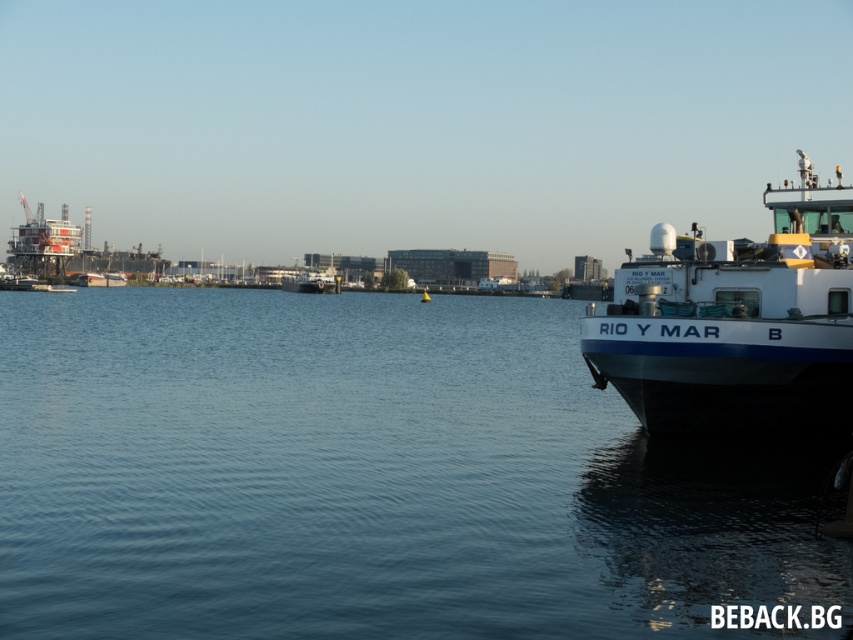
Can you confirm if blue water at center is positioned to the right of white matte boat at right?

No, blue water at center is not to the right of white matte boat at right.

Does blue water at center appear on the left side of white matte boat at right?

Correct, you'll find blue water at center to the left of white matte boat at right.

Is point (218, 305) positioned in front of point (817, 252)?

No, it is not.

Identify the location of blue water at center. (370, 477).

From the picture: Is blue water at center taller than reddish metallic structure at upper left?

In fact, blue water at center may be shorter than reddish metallic structure at upper left.

Is blue water at center thinner than reddish metallic structure at upper left?

Incorrect, blue water at center's width is not less than reddish metallic structure at upper left's.

Does point (210, 545) lie in front of point (90, 256)?

Yes, it is in front of point (90, 256).

Where is `blue water at center`? This screenshot has width=853, height=640. blue water at center is located at coordinates (370, 477).

Which of these two, white matte boat at right or reddish metallic structure at upper left, stands shorter?

Standing shorter between the two is white matte boat at right.

Can you confirm if white matte boat at right is taller than reddish metallic structure at upper left?

In fact, white matte boat at right may be shorter than reddish metallic structure at upper left.

Who is more distant from viewer, (813, 396) or (105, 262)?

The point (105, 262) is more distant.

Where is `white matte boat at right`? The height and width of the screenshot is (640, 853). white matte boat at right is located at coordinates (735, 323).